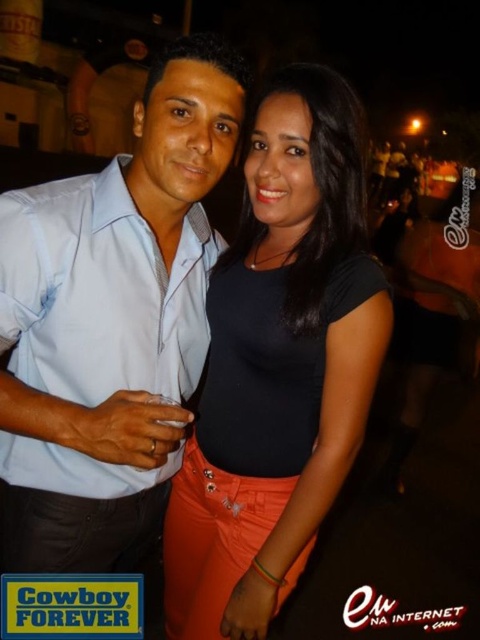
You are at a party and want to take a photo of both the light blue shirt at center and the black matte shirt at center. Since you need to frame them properly, which of the two shirts should you adjust to ensure both are fully visible in the photo?

The light blue shirt at center is not as tall as the black matte shirt at center, so you should lower the camera angle slightly to ensure the taller black matte shirt at center is fully visible while keeping the shorter light blue shirt at center in frame.

You are a photographer at the event and want to take a photo of both the light blue shirt at center and the black matte shirt at center. Which one should you focus on first to ensure both are in sharp focus?

The light blue shirt at center is closer to the viewer than the black matte shirt at center, so focus on the light blue shirt at center first to ensure both are in sharp focus.